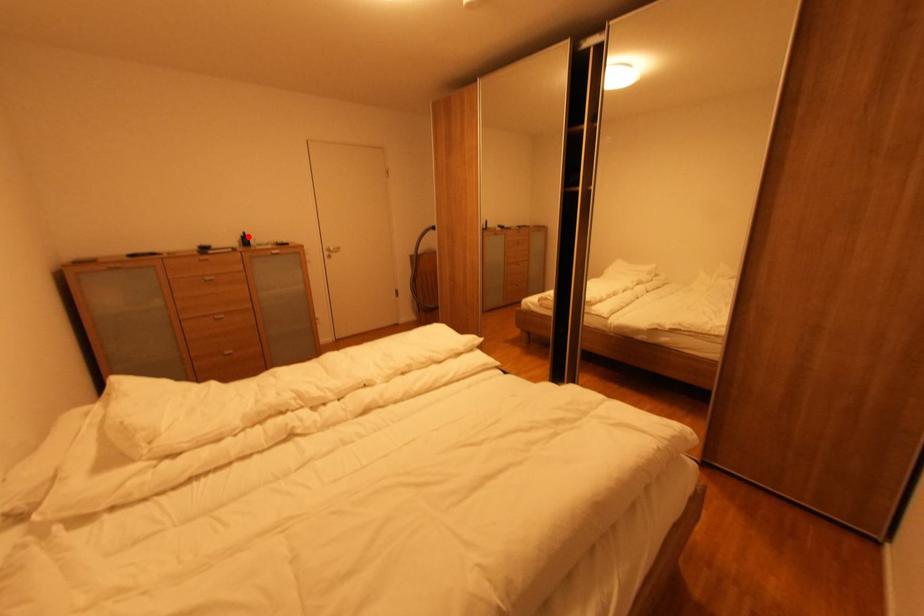
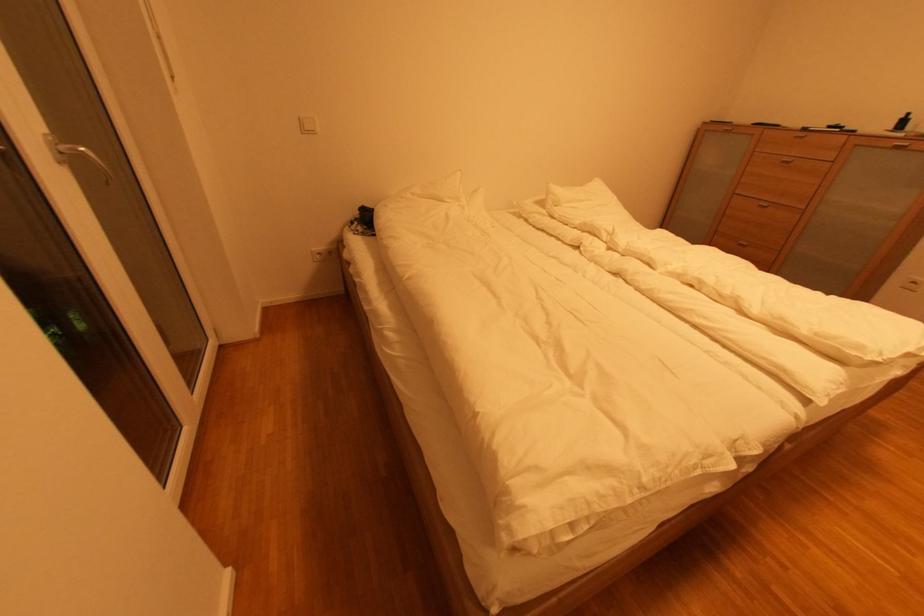
Question: I am providing you with two images of the same scene from different viewpoints. A red point is shown in image1. For the corresponding object point in image2, is it positioned nearer or farther from the camera?

Choices:
 (A) Nearer
 (B) Farther

Answer: (B)